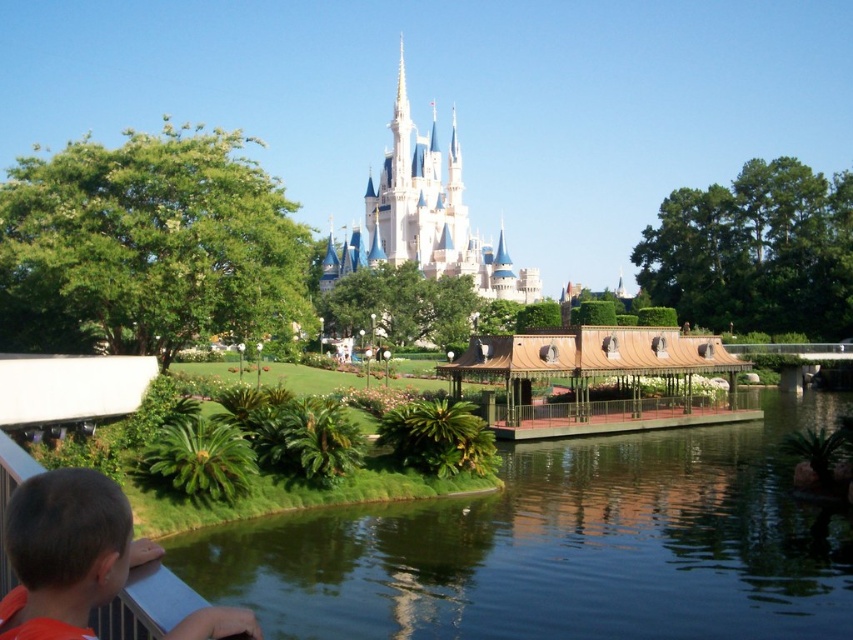
Question: Which point is farther to the camera?

Choices:
 (A) (494, 273)
 (B) (351, 573)
 (C) (76, 513)

Answer: (A)

Question: Is green smooth water at center thinner than orange fabric shirt at lower left?

Choices:
 (A) yes
 (B) no

Answer: (B)

Question: Can you confirm if green smooth water at center is bigger than white stone castle at center?

Choices:
 (A) yes
 (B) no

Answer: (A)

Question: Can you confirm if green smooth water at center is positioned above white stone castle at center?

Choices:
 (A) no
 (B) yes

Answer: (A)

Question: Which point appears closest to the camera in this image?

Choices:
 (A) (51, 556)
 (B) (512, 449)

Answer: (A)

Question: Which object appears closest to the camera in this image?

Choices:
 (A) orange fabric shirt at lower left
 (B) white stone castle at center

Answer: (A)